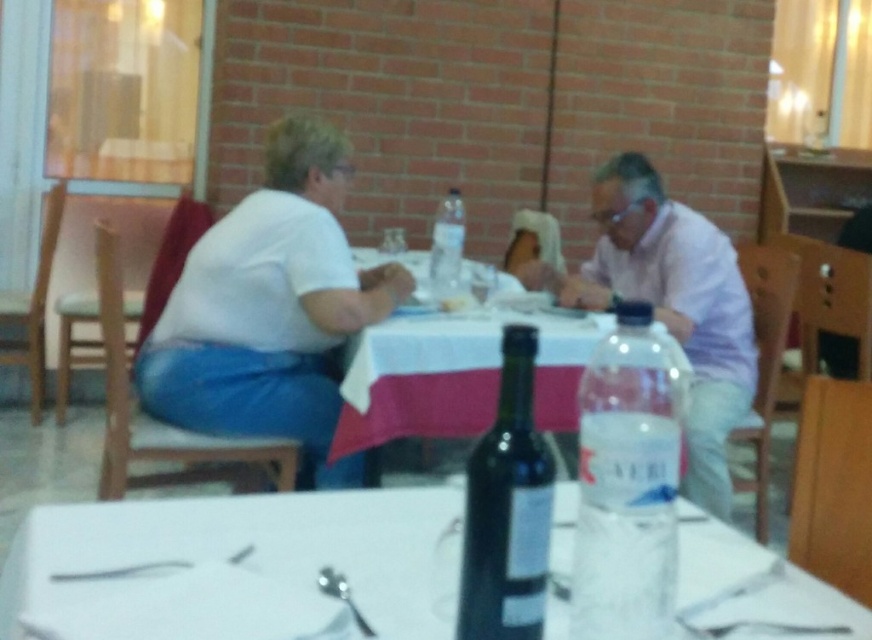
Who is shorter, clear plastic bottle at center or metallic silverware at lower left?

metallic silverware at lower left is shorter.

Is clear plastic bottle at center taller than metallic silverware at lower left?

Yes, clear plastic bottle at center is taller than metallic silverware at lower left.

What do you see at coordinates (446, 244) in the screenshot? I see `clear plastic bottle at center` at bounding box center [446, 244].

I want to click on clear plastic bottle at center, so click(x=446, y=244).

Can you confirm if dark glass bottle at center is shorter than clear plastic bottle at center?

Yes.

The height and width of the screenshot is (640, 872). What do you see at coordinates (508, 509) in the screenshot?
I see `dark glass bottle at center` at bounding box center [508, 509].

Find the location of a particular element. The height and width of the screenshot is (640, 872). dark glass bottle at center is located at coordinates [x=508, y=509].

Is pink fabric shirt at upper right positioned behind clear plastic bottle at center?

No, pink fabric shirt at upper right is closer to the viewer.

Who is shorter, pink fabric shirt at upper right or clear plastic bottle at center?

Standing shorter between the two is clear plastic bottle at center.

Find the location of a particular element. pink fabric shirt at upper right is located at coordinates (671, 305).

Where is `pink fabric shirt at upper right`? This screenshot has width=872, height=640. pink fabric shirt at upper right is located at coordinates (671, 305).